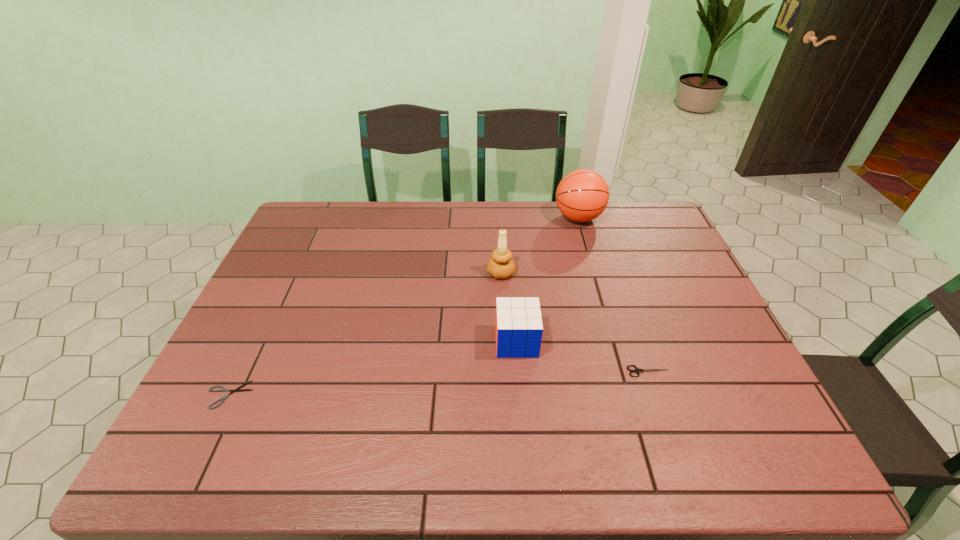
Locate an element on the screen. blank space at the far right corner of the desktop is located at coordinates (642, 226).

Where is `free point between the shorter shears and the cube`? free point between the shorter shears and the cube is located at coordinates (372, 368).

Locate an element on the screen. The width and height of the screenshot is (960, 540). unoccupied position between the fourth tallest object and the farthest object is located at coordinates (613, 294).

Locate an element on the screen. This screenshot has width=960, height=540. vacant space that's between the second shortest object and the leftmost object is located at coordinates (439, 383).

At what (x,y) coordinates should I click in order to perform the action: click on free space between the farthest object and the third tallest object. Please return your answer as a coordinate pair (x, y). The height and width of the screenshot is (540, 960). Looking at the image, I should click on (547, 280).

The height and width of the screenshot is (540, 960). Identify the location of vacant space that is in between the farthest object and the second farthest object. (540, 246).

Where is `unoccupied position between the leftmost object and the farthest object`? This screenshot has height=540, width=960. unoccupied position between the leftmost object and the farthest object is located at coordinates (404, 306).

Where is `vacant space in between the cube and the farthest object`? vacant space in between the cube and the farthest object is located at coordinates (547, 280).

The image size is (960, 540). What are the coordinates of `free spot between the shortest object and the farther shears` in the screenshot? It's located at (439, 383).

Where is `free space between the farthest object and the shortest object`? Image resolution: width=960 pixels, height=540 pixels. free space between the farthest object and the shortest object is located at coordinates (404, 306).